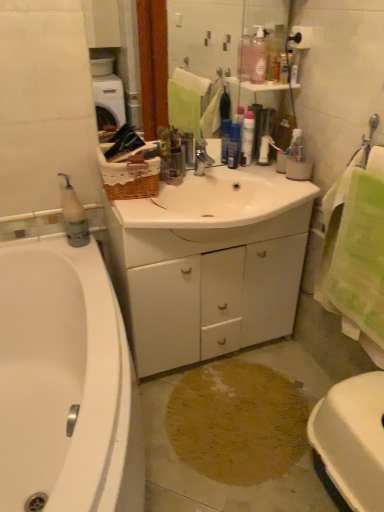
At what (x,y) coordinates should I click in order to perform the action: click on vacant area that is situated to the right of silver metallic faucet at center. Please return your answer as a coordinate pair (x, y). The image size is (384, 512). Looking at the image, I should click on (235, 180).